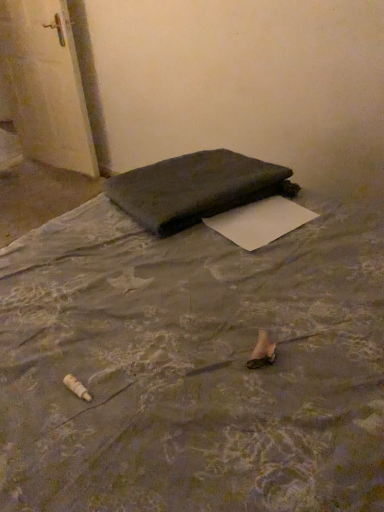
Image resolution: width=384 pixels, height=512 pixels. Describe the element at coordinates (46, 84) in the screenshot. I see `white glossy door at upper left` at that location.

The width and height of the screenshot is (384, 512). What do you see at coordinates (260, 221) in the screenshot?
I see `white paper at center` at bounding box center [260, 221].

The image size is (384, 512). Find the location of `white glossy door at upper left`. white glossy door at upper left is located at coordinates (46, 84).

Considering the sizes of dark fabric bag at center and dark fabric mattress at center in the image, is dark fabric bag at center taller or shorter than dark fabric mattress at center?

dark fabric bag at center is shorter than dark fabric mattress at center.

From the image's perspective, which one is positioned lower, dark fabric bag at center or dark fabric mattress at center?

From the image's view, dark fabric mattress at center is below.

Is dark fabric bag at center beside dark fabric mattress at center?

No, dark fabric bag at center is not making contact with dark fabric mattress at center.

Can you confirm if dark fabric bag at center is thinner than dark fabric mattress at center?

Correct, the width of dark fabric bag at center is less than that of dark fabric mattress at center.

Between dark fabric mattress at center and white glossy door at upper left, which one appears on the right side from the viewer's perspective?

From the viewer's perspective, dark fabric mattress at center appears more on the right side.

Can you confirm if dark fabric mattress at center is smaller than white glossy door at upper left?

Actually, dark fabric mattress at center might be larger than white glossy door at upper left.

Based on the photo, between dark fabric mattress at center and white glossy door at upper left, which one has less height?

white glossy door at upper left.

Relative to white glossy door at upper left, is dark fabric mattress at center in front or behind?

Clearly, dark fabric mattress at center is in front of white glossy door at upper left.

Which of these two, dark fabric mattress at center or white paper at center, is wider?

With larger width is dark fabric mattress at center.

From the picture: Can you confirm if dark fabric mattress at center is shorter than white paper at center?

Incorrect, the height of dark fabric mattress at center does not fall short of that of white paper at center.

Image resolution: width=384 pixels, height=512 pixels. What are the coordinates of `paper behind the dark fabric mattress at center` in the screenshot? It's located at (260, 221).

Which point is more forward, (268, 208) or (151, 187)?

Point (268, 208)

Does white paper at center have a larger size compared to dark fabric bag at center?

No.

Considering the sizes of objects white paper at center and dark fabric bag at center in the image provided, who is thinner, white paper at center or dark fabric bag at center?

With smaller width is white paper at center.

Considering the relative positions of white paper at center and dark fabric bag at center in the image provided, is white paper at center to the left of dark fabric bag at center from the viewer's perspective?

Incorrect, white paper at center is not on the left side of dark fabric bag at center.

Between white glossy door at upper left and dark fabric bag at center, which one has less height?

Standing shorter between the two is dark fabric bag at center.

Can we say white glossy door at upper left lies outside dark fabric bag at center?

Yes, white glossy door at upper left is not within dark fabric bag at center.

Which is behind, point (39, 120) or point (197, 210)?

Point (39, 120)

From a real-world perspective, is white glossy door at upper left below dark fabric bag at center?

Indeed, from a real-world perspective, white glossy door at upper left is positioned beneath dark fabric bag at center.

Is white paper at center at the back of dark fabric bag at center?

Yes, dark fabric bag at center is positioned with its back facing white paper at center.

Looking at this image, relative to white paper at center, is dark fabric bag at center in front or behind?

dark fabric bag at center is behind white paper at center.

From the image's perspective, is dark fabric bag at center over white paper at center?

Indeed, from the image's perspective, dark fabric bag at center is shown above white paper at center.

Looking at the image, does white glossy door at upper left seem bigger or smaller compared to dark fabric mattress at center?

white glossy door at upper left is smaller than dark fabric mattress at center.

Looking at this image, is white glossy door at upper left facing away from dark fabric mattress at center?

No, white glossy door at upper left's orientation is not away from dark fabric mattress at center.

Which point is more distant from viewer, (73,114) or (9,461)?

The point (73,114) is behind.

Locate an element on the screen. Image resolution: width=384 pixels, height=512 pixels. mattress that is on the left side of dark fabric bag at center is located at coordinates (192, 367).

At what (x,y) coordinates should I click in order to perform the action: click on door behind the dark fabric mattress at center. Please return your answer as a coordinate pair (x, y). The width and height of the screenshot is (384, 512). Looking at the image, I should click on (46, 84).

Based on their spatial positions, is white paper at center or white glossy door at upper left closer to dark fabric mattress at center?

white paper at center lies closer to dark fabric mattress at center than the other object.

Looking at this image, when comparing their distances from dark fabric bag at center, does white glossy door at upper left or white paper at center seem closer?

white paper at center is positioned closer to the anchor dark fabric bag at center.

When comparing their distances from white glossy door at upper left, does white paper at center or dark fabric mattress at center seem further?

dark fabric mattress at center.

Which object lies further to the anchor point dark fabric mattress at center, white glossy door at upper left or dark fabric bag at center?

white glossy door at upper left lies further to dark fabric mattress at center than the other object.

Looking at the image, which one is located closer to white paper at center, white glossy door at upper left or dark fabric bag at center?

Based on the image, dark fabric bag at center appears to be nearer to white paper at center.

Looking at the image, which one is located closer to dark fabric bag at center, white paper at center or white glossy door at upper left?

white paper at center is positioned closer to the anchor dark fabric bag at center.

Estimate the real-world distances between objects in this image. Which object is closer to dark fabric bag at center, white glossy door at upper left or dark fabric mattress at center?

Among the two, dark fabric mattress at center is located nearer to dark fabric bag at center.

Considering their positions, is dark fabric mattress at center positioned further to dark fabric bag at center than white glossy door at upper left?

white glossy door at upper left lies further to dark fabric bag at center than the other object.

Find the location of `paper between dark fabric mattress at center and white glossy door at upper left in the front-back direction`. paper between dark fabric mattress at center and white glossy door at upper left in the front-back direction is located at coordinates (260, 221).

The height and width of the screenshot is (512, 384). What are the coordinates of `paper positioned between dark fabric mattress at center and dark fabric bag at center from near to far` in the screenshot? It's located at point(260,221).

Locate an element on the screen. The height and width of the screenshot is (512, 384). furniture between dark fabric mattress at center and white glossy door at upper left in the front-back direction is located at coordinates (195, 188).

The width and height of the screenshot is (384, 512). I want to click on furniture between white glossy door at upper left and white paper at center in the horizontal direction, so click(195, 188).